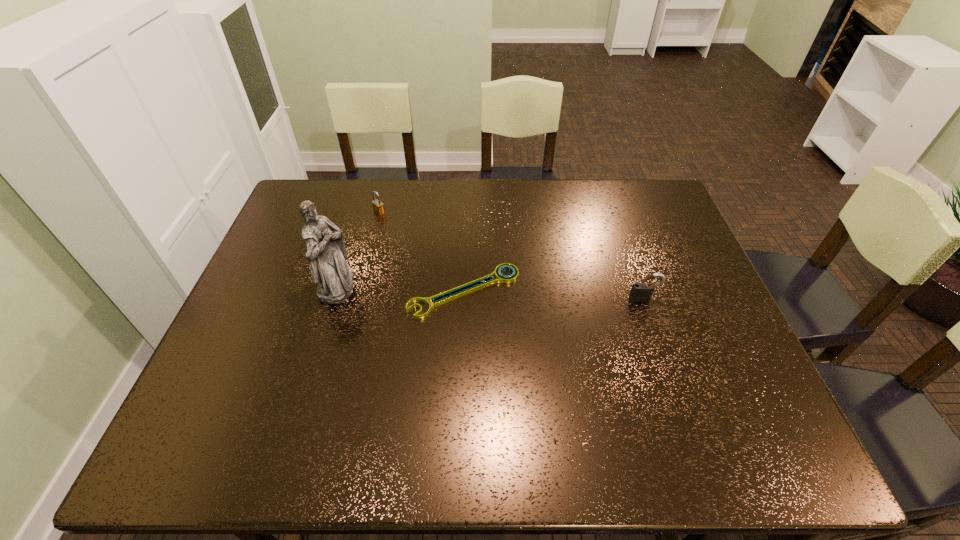
I want to click on vacant space that satisfies the following two spatial constraints: 1. on the front-facing side of the figurine; 2. on the right side of the wrench, so click(x=335, y=291).

This screenshot has height=540, width=960. I want to click on vacant space that satisfies the following two spatial constraints: 1. on the front side of the third tallest object; 2. on the left side of the wrench, so click(x=359, y=291).

The image size is (960, 540). I want to click on vacant space that satisfies the following two spatial constraints: 1. on the front-facing side of the shortest object; 2. on the left side of the tallest object, so click(335, 291).

This screenshot has width=960, height=540. I want to click on free location that satisfies the following two spatial constraints: 1. on the front-facing side of the tallest object; 2. on the right side of the shortest object, so click(335, 291).

Locate an element on the screen. vacant space that satisfies the following two spatial constraints: 1. on the front-facing side of the second object from right to left; 2. on the right side of the tallest object is located at coordinates (335, 291).